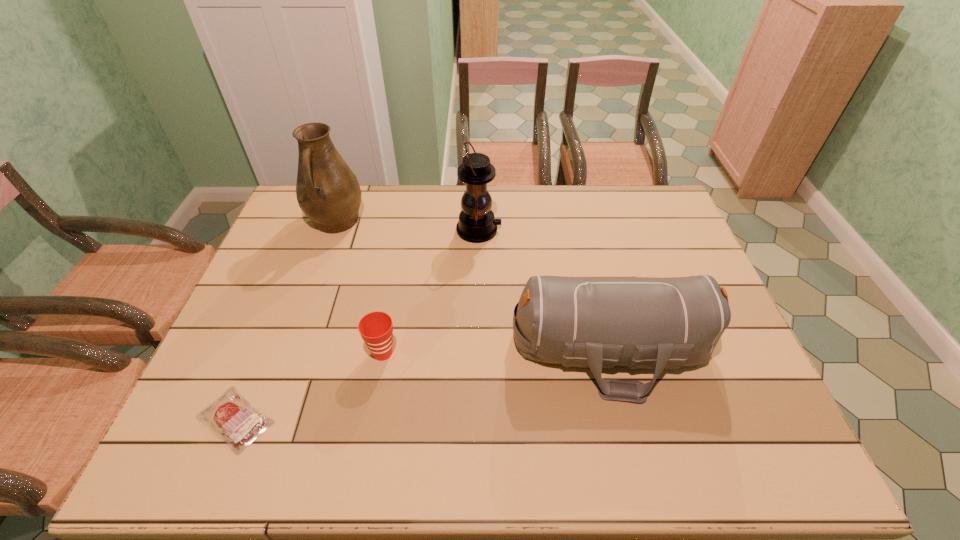
Image resolution: width=960 pixels, height=540 pixels. What are the coordinates of `free space that is in between the shortest object and the third shortest object` in the screenshot? It's located at (423, 384).

This screenshot has width=960, height=540. I want to click on free space between the lantern and the third object from right to left, so click(x=431, y=292).

Identify the location of vacant space that's between the pitcher and the third shortest object. click(473, 286).

Find the location of `free point between the second object from right to left and the steak`. free point between the second object from right to left and the steak is located at coordinates (357, 325).

This screenshot has height=540, width=960. Find the location of `object that stands as the third closest to the lantern`. object that stands as the third closest to the lantern is located at coordinates (376, 328).

This screenshot has width=960, height=540. Identify the location of object identified as the fourth closest to the steak. (476, 224).

At what (x,y) coordinates should I click in order to perform the action: click on vacant space that satisfies the following two spatial constraints: 1. above the lantern, indicating its light source; 2. on the front side of the shortest object. Please return your answer as a coordinate pair (x, y). This screenshot has width=960, height=540. Looking at the image, I should click on coord(478,419).

Where is `vacant region that satisfies the following two spatial constraints: 1. on the back side of the duffel bag; 2. on the left side of the third object from left to right`? vacant region that satisfies the following two spatial constraints: 1. on the back side of the duffel bag; 2. on the left side of the third object from left to right is located at coordinates (383, 349).

The width and height of the screenshot is (960, 540). I want to click on free space in the image that satisfies the following two spatial constraints: 1. on the back side of the rightmost object; 2. on the left side of the steak, so click(x=264, y=349).

This screenshot has width=960, height=540. I want to click on free point that satisfies the following two spatial constraints: 1. on the handle side of the pitcher; 2. on the right side of the rightmost object, so click(291, 349).